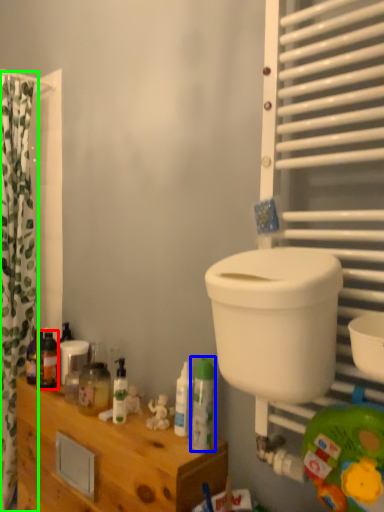
Question: Based on their relative distances, which object is nearer to toiletry (highlighted by a red box)? Choose from toiletry (highlighted by a blue box) and curtain (highlighted by a green box).

Choices:
 (A) toiletry
 (B) curtain

Answer: (B)